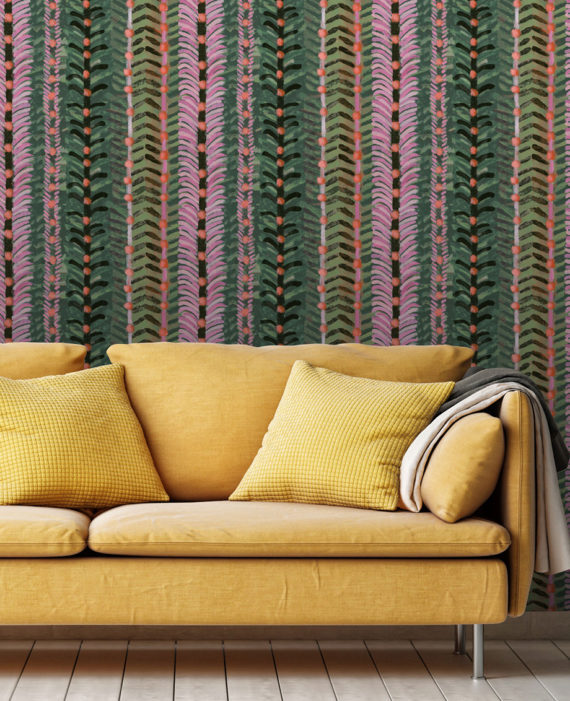
Identify the location of wall. The image size is (570, 701). (246, 139).